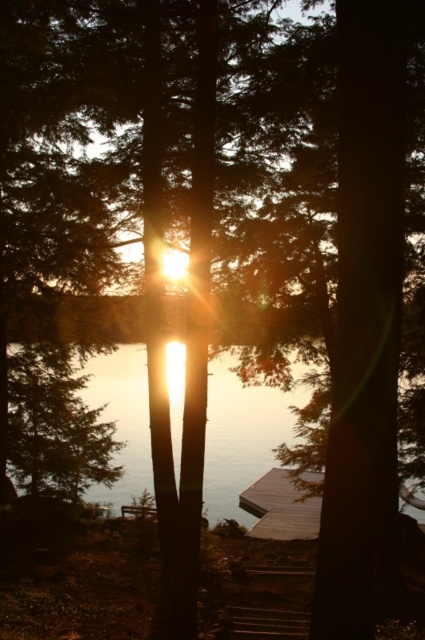
Can you confirm if translucent glass water at center is positioned to the right of wooden dock at lower center?

Incorrect, translucent glass water at center is not on the right side of wooden dock at lower center.

Is translucent glass water at center positioned before wooden dock at lower center?

That is True.

Does point (105, 496) come behind point (316, 509)?

Yes, it is.

Find the location of a particular element. The image size is (425, 640). translucent glass water at center is located at coordinates (241, 436).